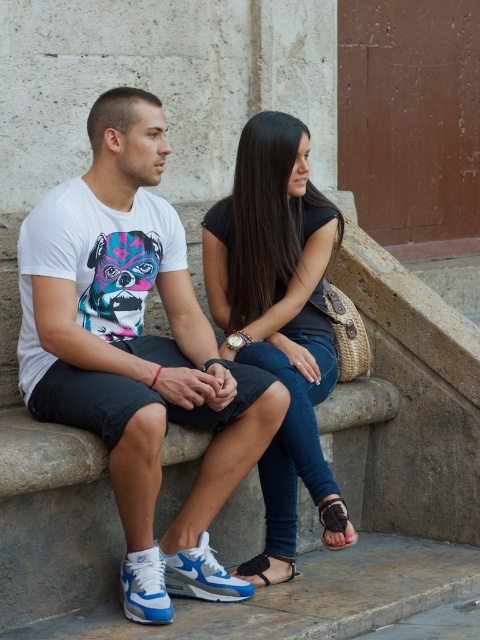
Does black matte jeans at center have a larger size compared to black leather sandal at lower center?

Correct, black matte jeans at center is larger in size than black leather sandal at lower center.

Between black matte jeans at center and black leather sandal at lower center, which one appears on the right side from the viewer's perspective?

black matte jeans at center is more to the right.

The height and width of the screenshot is (640, 480). What do you see at coordinates (277, 301) in the screenshot?
I see `black matte jeans at center` at bounding box center [277, 301].

The height and width of the screenshot is (640, 480). In order to click on black matte jeans at center in this screenshot , I will do `click(277, 301)`.

Which is below, white matte t-shirt at center or black matte jeans at center?

white matte t-shirt at center is lower down.

Can you confirm if white matte t-shirt at center is thinner than black matte jeans at center?

Incorrect, white matte t-shirt at center's width is not less than black matte jeans at center's.

Which is in front, point (29, 272) or point (272, 502)?

Point (29, 272) is in front.

Find the location of a particular element. white matte t-shirt at center is located at coordinates (136, 353).

Is black matte jeans at center in front of brown leather sandal at lower center?

No, it is behind brown leather sandal at lower center.

Does black matte jeans at center have a lesser width compared to brown leather sandal at lower center?

In fact, black matte jeans at center might be wider than brown leather sandal at lower center.

Is point (275, 497) positioned before point (348, 538)?

No, it is not.

I want to click on black matte jeans at center, so click(x=277, y=301).